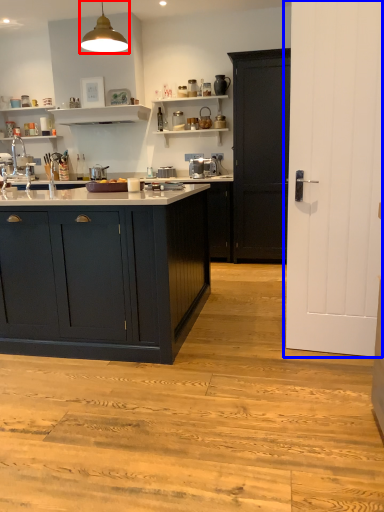
Question: Among these objects, which one is nearest to the camera, light fixture (highlighted by a red box) or door (highlighted by a blue box)?

Choices:
 (A) light fixture
 (B) door

Answer: (B)